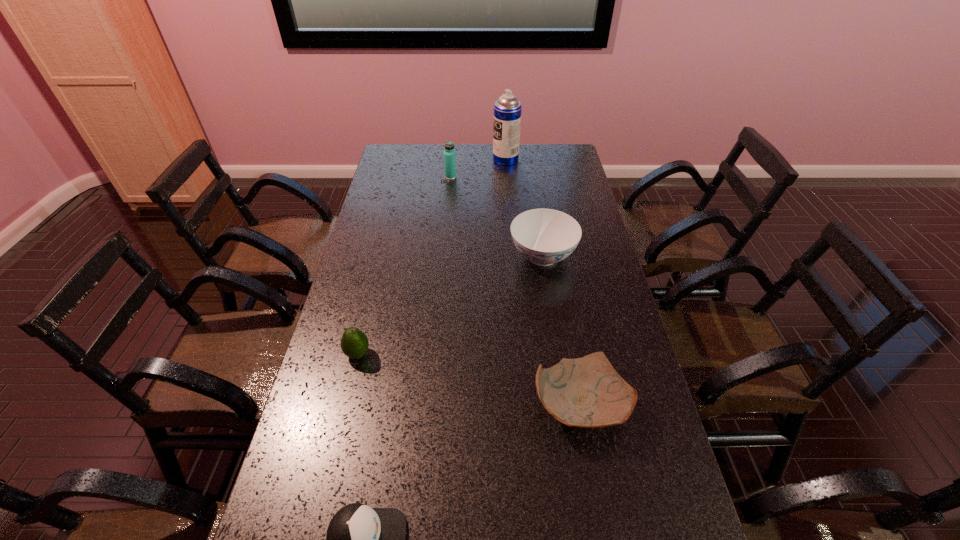
This screenshot has width=960, height=540. I want to click on vacant point that satisfies the following two spatial constraints: 1. on the label side of the tallest object; 2. on the right side of the chinaware, so click(514, 256).

Image resolution: width=960 pixels, height=540 pixels. What are the coordinates of `free spot that satisfies the following two spatial constraints: 1. on the label side of the aerosol can; 2. on the front side of the fourth object from right to left` in the screenshot? It's located at (507, 177).

At what (x,y) coordinates should I click in order to perform the action: click on free space in the image that satisfies the following two spatial constraints: 1. on the label side of the farthest object; 2. on the left side of the fourth nearest object. Please return your answer as a coordinate pair (x, y). The width and height of the screenshot is (960, 540). Looking at the image, I should click on (514, 256).

Locate an element on the screen. The height and width of the screenshot is (540, 960). vacant space that satisfies the following two spatial constraints: 1. on the label side of the tallest object; 2. on the right side of the pottery is located at coordinates (526, 404).

Where is `vacant region that satisfies the following two spatial constraints: 1. on the front side of the fourth farthest object; 2. on the left side of the pottery`? The width and height of the screenshot is (960, 540). vacant region that satisfies the following two spatial constraints: 1. on the front side of the fourth farthest object; 2. on the left side of the pottery is located at coordinates (346, 404).